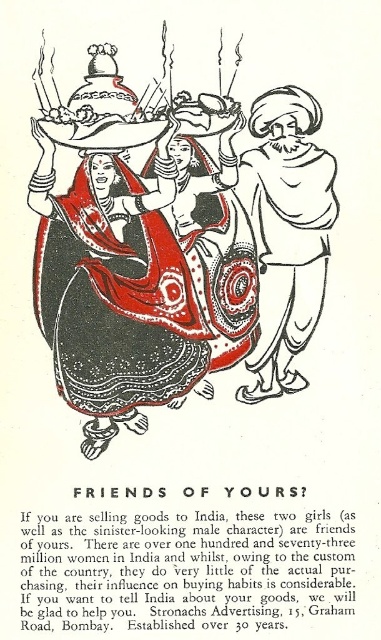
Between matte black dress at center and white paper turban at center, which one appears on the right side from the viewer's perspective?

Positioned to the right is white paper turban at center.

Who is taller, matte black dress at center or white paper turban at center?

With more height is matte black dress at center.

What do you see at coordinates (174, 241) in the screenshot? I see `matte black dress at center` at bounding box center [174, 241].

Locate an element on the screen. Image resolution: width=381 pixels, height=640 pixels. matte black dress at center is located at coordinates (174, 241).